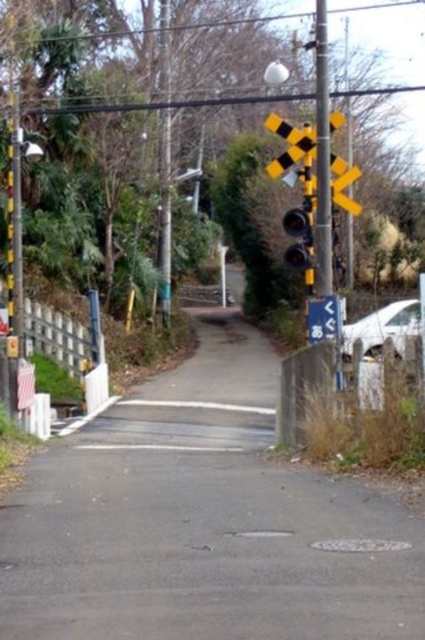
You are a driver approaching the asphalt road at center and the metallic traffic light at center. Which object will you see first as you drive towards them?

The asphalt road at center will be seen first because it is larger in size than the metallic traffic light at center, making it more prominent in the driver s view.